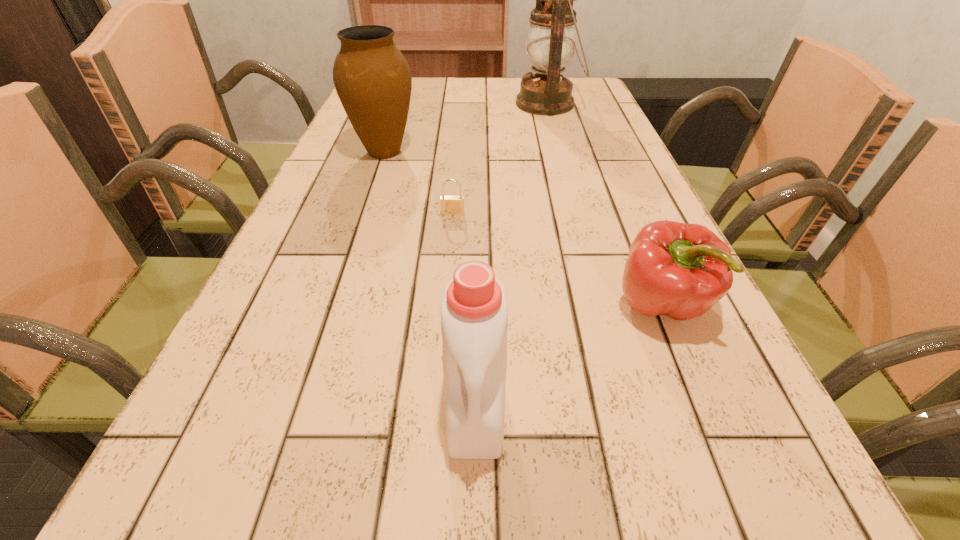
At what (x,y) coordinates should I click in order to perform the action: click on the farthest object. Please return your answer as a coordinate pair (x, y). Looking at the image, I should click on (551, 35).

This screenshot has height=540, width=960. Identify the location of the tallest object. click(x=551, y=35).

The height and width of the screenshot is (540, 960). I want to click on the fourth shortest object, so click(372, 78).

This screenshot has width=960, height=540. What are the coordinates of `the second farthest object` in the screenshot? It's located at [372, 78].

This screenshot has width=960, height=540. I want to click on detergent, so click(474, 313).

This screenshot has width=960, height=540. I want to click on the third tallest object, so click(474, 313).

Locate an element on the screen. The image size is (960, 540). the second shortest object is located at coordinates (679, 270).

The height and width of the screenshot is (540, 960). I want to click on pepper, so click(679, 270).

At what (x,y) coordinates should I click in order to perform the action: click on the third nearest object. Please return your answer as a coordinate pair (x, y). Image resolution: width=960 pixels, height=540 pixels. Looking at the image, I should click on (452, 205).

Locate an element on the screen. This screenshot has height=540, width=960. the shortest object is located at coordinates (452, 205).